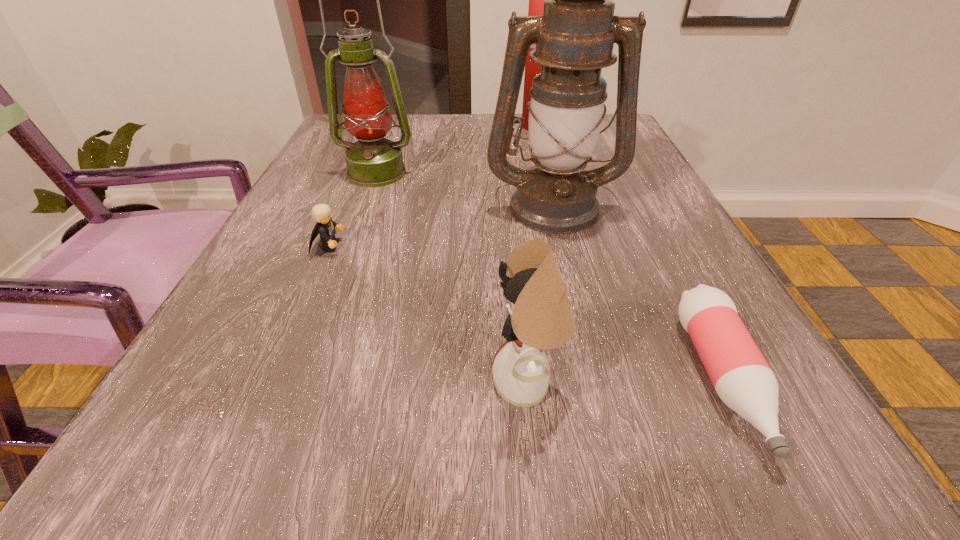
Locate an element on the screen. vacant space that is in between the bottle and the third shortest object is located at coordinates (626, 381).

Locate an element on the screen. This screenshot has width=960, height=540. vacant area between the doll and the left oil lamp is located at coordinates (453, 278).

This screenshot has height=540, width=960. Find the location of `empty space between the fifth tallest object and the left oil lamp`. empty space between the fifth tallest object and the left oil lamp is located at coordinates (352, 210).

Where is `empty space between the right oil lamp and the left oil lamp`? This screenshot has height=540, width=960. empty space between the right oil lamp and the left oil lamp is located at coordinates (465, 190).

Find the location of a particular element. free area in between the left oil lamp and the fire extinguisher is located at coordinates (458, 150).

This screenshot has width=960, height=540. I want to click on the third closest object to the left oil lamp, so (x=536, y=0).

Where is `the second closest object relative to the shortest object`? the second closest object relative to the shortest object is located at coordinates (575, 36).

The width and height of the screenshot is (960, 540). What are the coordinates of `vacant area that satisfies the following two spatial constraints: 1. with the cap open on the bottle; 2. at the front face of the fourth tallest object` in the screenshot? It's located at (725, 383).